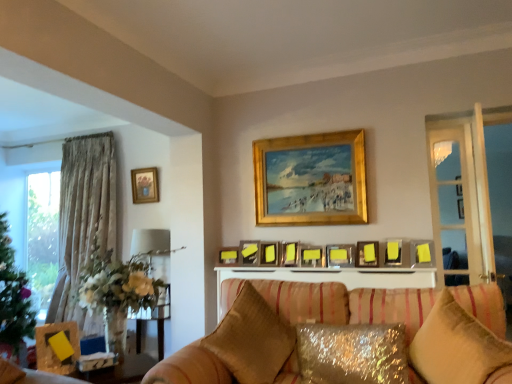
At what (x,y) coordinates should I click in order to perform the action: click on vacant point above gold wooden picture frame at upper center, marked as the 6th picture frame in a front-to-back arrangement (from a real-world perspective). Please return your answer as a coordinate pair (x, y). The height and width of the screenshot is (384, 512). Looking at the image, I should click on (300, 137).